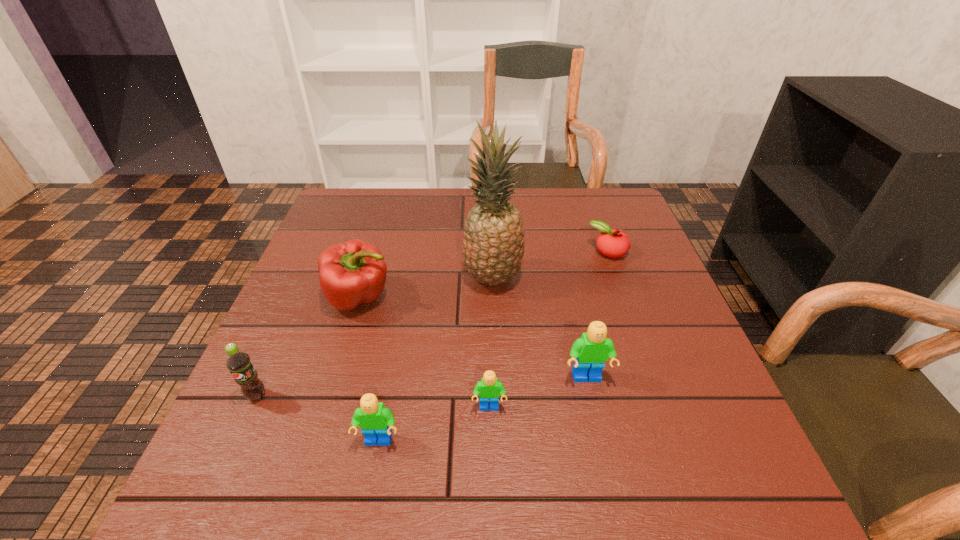
Locate an element on the screen. This screenshot has width=960, height=540. the leftmost Lego is located at coordinates (375, 421).

The image size is (960, 540). In order to click on the nearest Lego in this screenshot , I will do `click(375, 421)`.

Locate an element on the screen. the second farthest Lego is located at coordinates (489, 389).

You are a GUI agent. You are given a task and a screenshot of the screen. Output one action in this format:
    pyautogui.click(x=<x>, y=<y>)
    Task: Click on the second Lego from left to right
    Image resolution: width=960 pixels, height=540 pixels.
    Given the screenshot: What is the action you would take?
    pyautogui.click(x=489, y=389)

This screenshot has width=960, height=540. I want to click on the tallest Lego, so click(589, 352).

The image size is (960, 540). In order to click on the sixth object from left to right in this screenshot , I will do `click(589, 352)`.

The width and height of the screenshot is (960, 540). In order to click on the tallest object in this screenshot , I will do `click(494, 241)`.

This screenshot has width=960, height=540. Find the location of `apple`. apple is located at coordinates (612, 243).

In order to click on the shortest object in this screenshot , I will do `click(612, 243)`.

You are a GUI agent. You are given a task and a screenshot of the screen. Output one action in this format:
    pyautogui.click(x=<x>, y=<y>)
    Task: Click on the bell pepper
    The height and width of the screenshot is (540, 960).
    Given the screenshot: What is the action you would take?
    pyautogui.click(x=354, y=272)